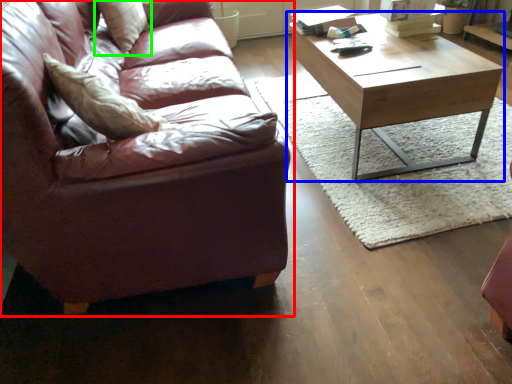
Question: Which object is positioned closest to studio couch (highlighted by a red box)? Select from coffee table (highlighted by a blue box) and pillow (highlighted by a green box).

Choices:
 (A) coffee table
 (B) pillow

Answer: (B)